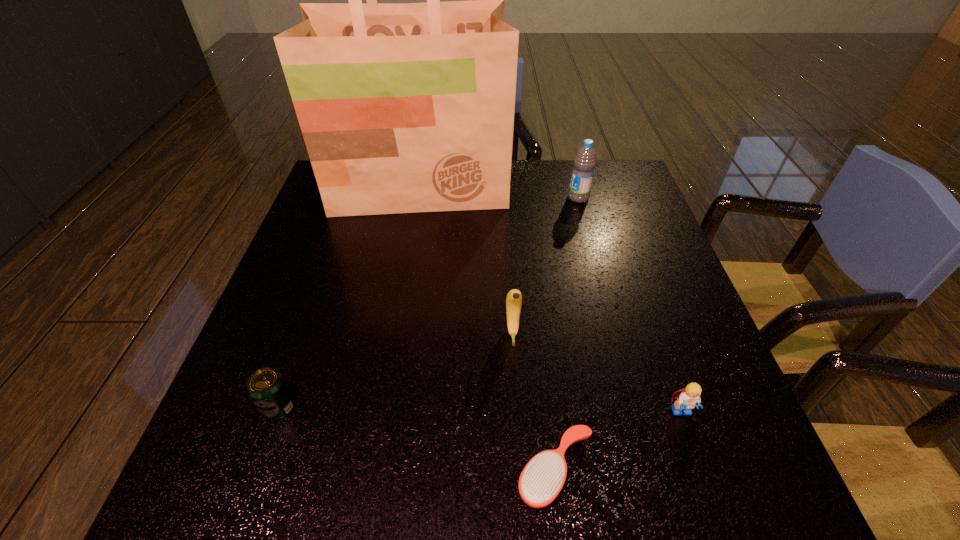
This screenshot has width=960, height=540. I want to click on water bottle located at the right edge, so click(584, 162).

Where is `Lego at the right edge`? The image size is (960, 540). Lego at the right edge is located at coordinates (687, 398).

At what (x,y) coordinates should I click in order to perform the action: click on object that is at the far left corner. Please return your answer as a coordinate pair (x, y). The height and width of the screenshot is (540, 960). Looking at the image, I should click on (404, 108).

The width and height of the screenshot is (960, 540). I want to click on object that is at the far right corner, so click(x=584, y=162).

The width and height of the screenshot is (960, 540). In order to click on vacant space at the far edge in this screenshot , I will do `click(516, 190)`.

Where is `blank area at the left edge`? This screenshot has height=540, width=960. blank area at the left edge is located at coordinates (314, 266).

The width and height of the screenshot is (960, 540). I want to click on vacant position at the right edge of the desktop, so click(x=660, y=297).

Identify the location of vacant space at the far right corner of the desktop. (600, 196).

This screenshot has width=960, height=540. What are the coordinates of `free space at the near right corner of the desktop` in the screenshot? It's located at (754, 476).

The height and width of the screenshot is (540, 960). Find the location of `free spot between the grocery bag and the nearest object`. free spot between the grocery bag and the nearest object is located at coordinates (488, 329).